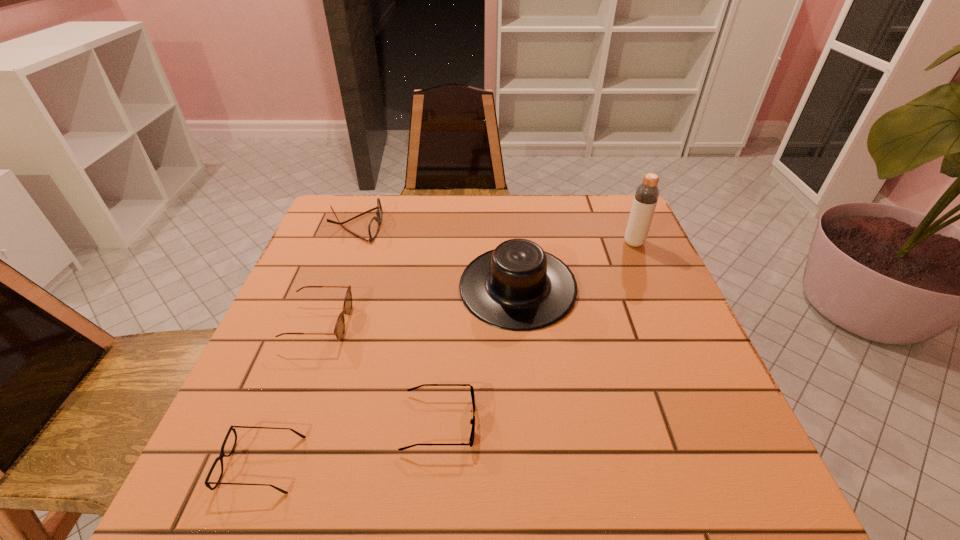
The image size is (960, 540). Find the location of `free space at the left edge of the desktop`. free space at the left edge of the desktop is located at coordinates (314, 401).

Locate an element on the screen. The height and width of the screenshot is (540, 960). free location at the right edge is located at coordinates (648, 396).

At what (x,y) coordinates should I click in order to perform the action: click on free region at the far left corner of the desktop. Please return your answer as a coordinate pair (x, y). Image resolution: width=960 pixels, height=540 pixels. Looking at the image, I should click on (362, 212).

I want to click on blank space at the far right corner of the desktop, so click(x=605, y=204).

In order to click on unoccupied area between the dress hat and the rightmost spectacles in this screenshot , I will do `click(478, 355)`.

Where is `free spot between the second tallest object and the third nearest spectacles`? The image size is (960, 540). free spot between the second tallest object and the third nearest spectacles is located at coordinates (419, 306).

Where is `vacant region between the rightmost spectacles and the second farthest spectacles`? This screenshot has height=540, width=960. vacant region between the rightmost spectacles and the second farthest spectacles is located at coordinates (379, 373).

Locate an element on the screen. empty space that is in between the rightmost spectacles and the dress hat is located at coordinates (478, 355).

Where is `vacant space that is in between the rightmost spectacles and the rightmost object`? This screenshot has width=960, height=540. vacant space that is in between the rightmost spectacles and the rightmost object is located at coordinates (537, 333).

The image size is (960, 540). I want to click on free area in between the farthest spectacles and the fifth shortest object, so click(437, 256).